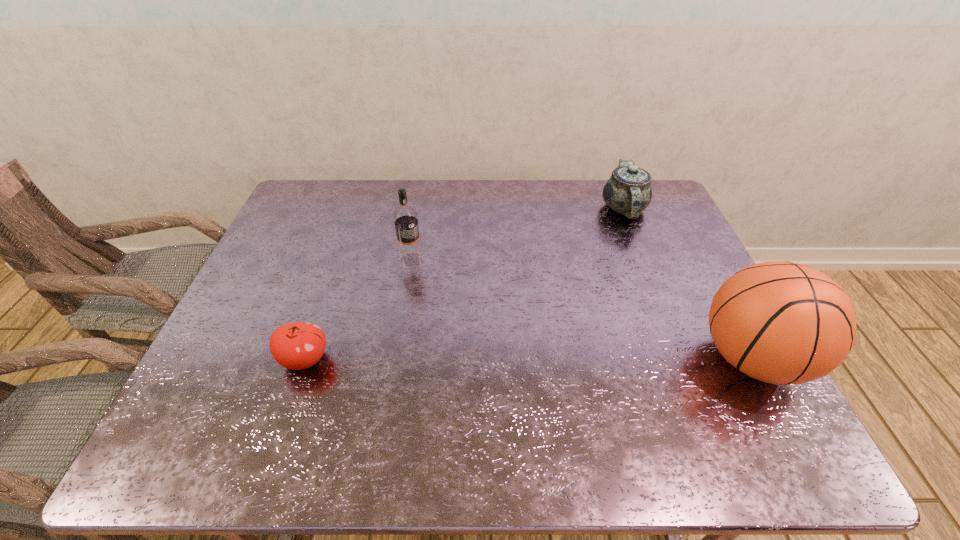
At what (x,y) coordinates should I click in order to perform the action: click on the shortest object. Please return your answer as a coordinate pair (x, y). This screenshot has width=960, height=540. Looking at the image, I should click on (299, 345).

This screenshot has height=540, width=960. Find the location of `apple`. apple is located at coordinates (299, 345).

Where is `basketball`? basketball is located at coordinates (780, 322).

Find the location of a particular element. Image resolution: width=960 pixels, height=540 pixels. the third object from right to left is located at coordinates (410, 254).

This screenshot has width=960, height=540. Find the location of `vodka`. vodka is located at coordinates (410, 254).

The height and width of the screenshot is (540, 960). Find the location of `the second shortest object`. the second shortest object is located at coordinates (628, 191).

I want to click on the farthest object, so click(x=628, y=191).

The height and width of the screenshot is (540, 960). I want to click on free space located 0.250m on the back of the shortest object, so click(336, 271).

In order to click on vacant area situated 0.210m on the back of the basketball in this screenshot , I will do `click(700, 262)`.

Where is `free space located 0.220m on the label of the vodka`? The height and width of the screenshot is (540, 960). free space located 0.220m on the label of the vodka is located at coordinates (444, 320).